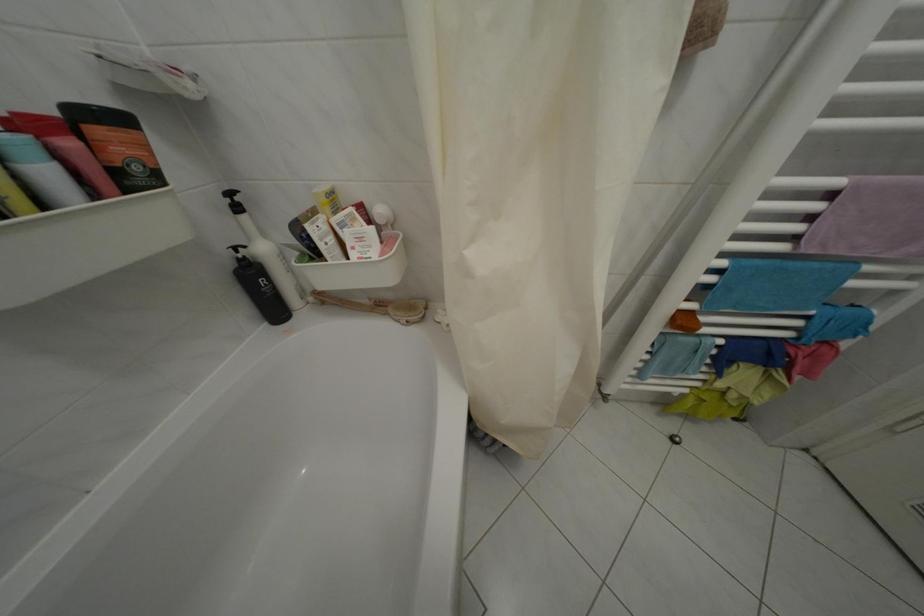
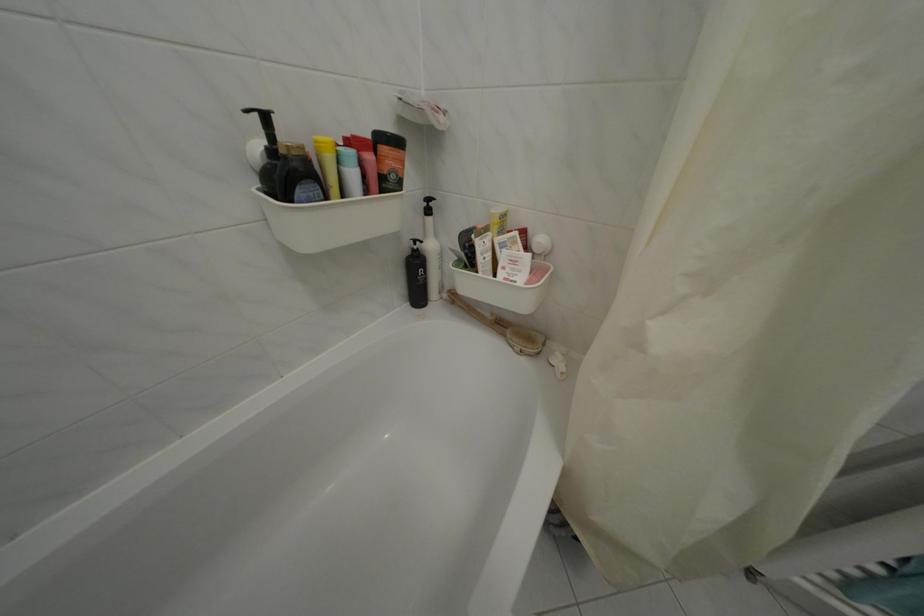
Locate, in the second image, the point that corresponds to the point at 249,262 in the first image.

(424, 254)